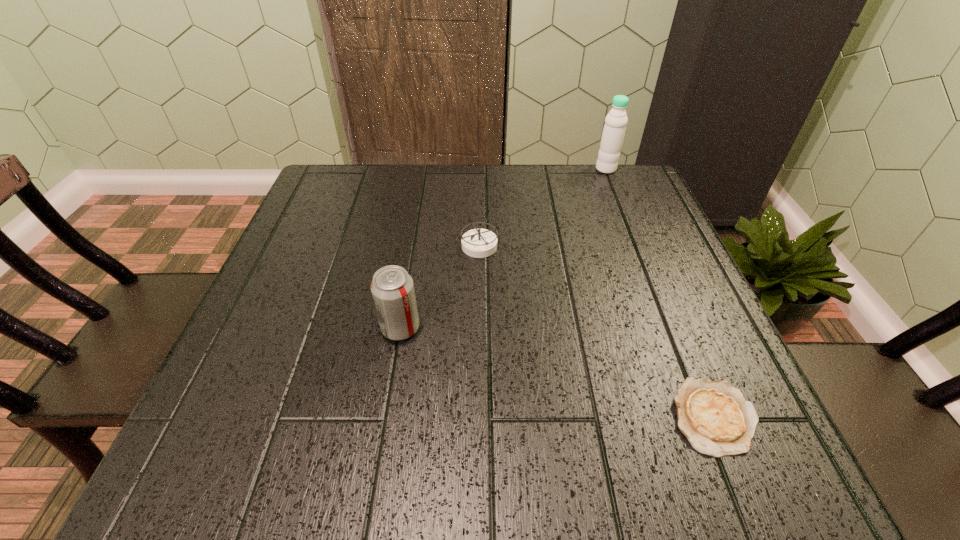
Image resolution: width=960 pixels, height=540 pixels. I want to click on vacant region at the left edge of the desktop, so click(286, 353).

Find the location of a particular element. This screenshot has width=960, height=540. free space at the right edge of the desktop is located at coordinates (620, 230).

In the image, there is a desktop. Where is `blank space at the far left corner`? The width and height of the screenshot is (960, 540). blank space at the far left corner is located at coordinates (379, 172).

Identify the location of vacant space at the near left corner. This screenshot has height=540, width=960. (245, 430).

Find the location of `vacant region between the water bottle and the third tallest object`. vacant region between the water bottle and the third tallest object is located at coordinates (542, 207).

The image size is (960, 540). I want to click on vacant point located between the tallest object and the third tallest object, so click(x=542, y=207).

Image resolution: width=960 pixels, height=540 pixels. Find the location of `vacant space in between the nearest object and the third object from right to left`. vacant space in between the nearest object and the third object from right to left is located at coordinates (596, 331).

Locate an element on the screen. free point between the leftmost object and the quiche is located at coordinates (557, 372).

The width and height of the screenshot is (960, 540). I want to click on free space between the compass and the nearest object, so click(596, 331).

Where is `unoccupied position between the quiche and the compass`? This screenshot has width=960, height=540. unoccupied position between the quiche and the compass is located at coordinates (596, 331).